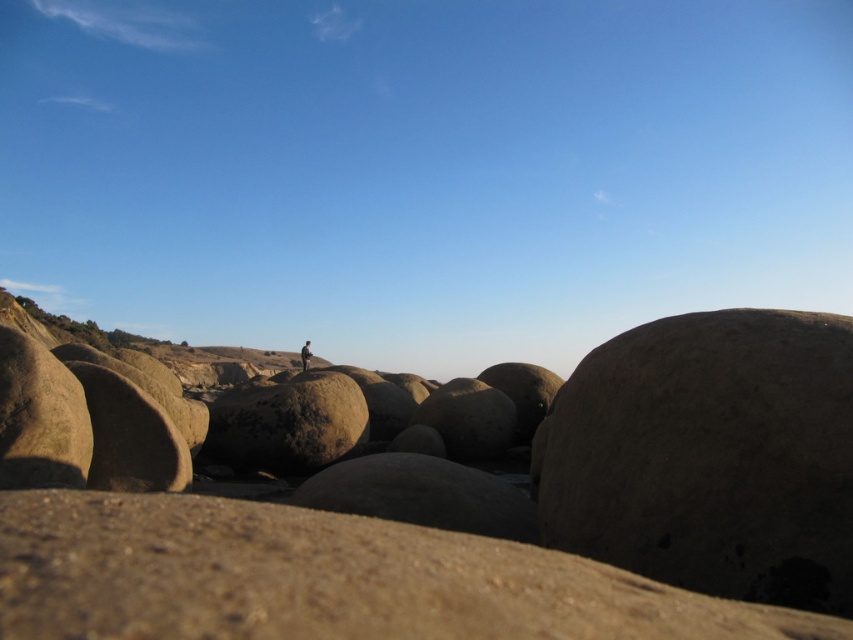
You are standing at the point closer to the camera in this landscape. Which point are you at, point (567, 582) or point (334, 616)?

You are at point (567, 582) because it is further to the camera than point (334, 616).

You are standing at the point with coordinates point (664, 406) and want to move towards the horizon. Which direction should you walk to reach the point that is closer to the camera, point (671, 540)?

To reach point (671, 540) from point (664, 406), you should walk towards the direction where the point (671, 540) is located, which is closer to the camera compared to your current position at point (664, 406).

You are standing at the point marked by the coordinates point (450, 508) in the image. What type of rocks are you standing on?

The point (450, 508) indicates smooth sandstone rocks at center.